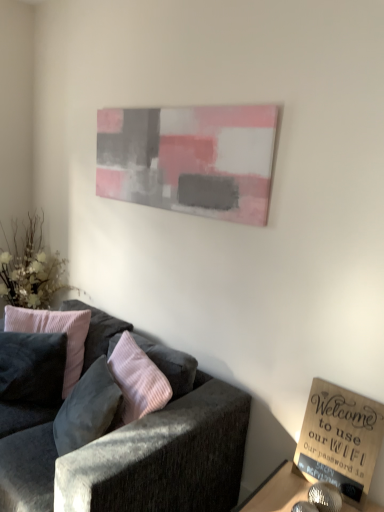
What do you see at coordinates (88, 409) in the screenshot? I see `velvet pink pillow at left, which appears as the 2th pillow when viewed from the left` at bounding box center [88, 409].

The width and height of the screenshot is (384, 512). What do you see at coordinates (340, 440) in the screenshot?
I see `wooden sign at lower right` at bounding box center [340, 440].

Locate an element on the screen. white fabric floral arrangement at left is located at coordinates (31, 269).

At what (x,y) coordinates should I click in order to perform the action: click on painted canvas at upper center. Please return your answer as a coordinate pair (x, y). The height and width of the screenshot is (512, 384). Looking at the image, I should click on (189, 159).

What do you see at coordinates (55, 332) in the screenshot? The height and width of the screenshot is (512, 384). I see `pink velvet pillow at left, acting as the first pillow starting from the left` at bounding box center [55, 332].

Where is `velvet pink pillow at left, placed as the 1th pillow when sorted from right to left`? velvet pink pillow at left, placed as the 1th pillow when sorted from right to left is located at coordinates (88, 409).

From the image's perspective, is velvet pink pillow at left, placed as the 1th pillow when sorted from right to left, positioned above or below wooden sign at lower right?

velvet pink pillow at left, placed as the 1th pillow when sorted from right to left, is situated higher than wooden sign at lower right in the image.

What's the angular difference between velvet pink pillow at left, which appears as the 2th pillow when viewed from the left, and wooden sign at lower right's facing directions?

velvet pink pillow at left, which appears as the 2th pillow when viewed from the left, and wooden sign at lower right are facing 23.6 degrees away from each other.

Is point (99, 404) farther from viewer compared to point (238, 505)?

No.

Looking at their sizes, would you say velvet pink pillow at left, placed as the 1th pillow when sorted from right to left, is wider or thinner than wooden sign at lower right?

In the image, velvet pink pillow at left, placed as the 1th pillow when sorted from right to left, appears to be more narrow than wooden sign at lower right.

The height and width of the screenshot is (512, 384). What are the coordinates of `floral arrangement located on the left of wooden sign at lower right` in the screenshot? It's located at (31, 269).

From a real-world perspective, is white fabric floral arrangement at left positioned over wooden sign at lower right based on gravity?

Yes, from a real-world perspective, white fabric floral arrangement at left is above wooden sign at lower right.

Is wooden sign at lower right at the back of white fabric floral arrangement at left?

No, white fabric floral arrangement at left's orientation is not away from wooden sign at lower right.

Measure the distance between white fabric floral arrangement at left and wooden sign at lower right.

white fabric floral arrangement at left and wooden sign at lower right are 6.81 feet apart.

What's the angular difference between pink velvet pillow at left, placed as the second pillow when sorted from right to left, and velvet dark gray couch at lower left's facing directions?

They differ by 35.2 degrees in their facing directions.

From the image's perspective, relative to velvet dark gray couch at lower left, is pink velvet pillow at left, placed as the second pillow when sorted from right to left, above or below?

Clearly, from the image's perspective, pink velvet pillow at left, placed as the second pillow when sorted from right to left, is above velvet dark gray couch at lower left.

Would you say pink velvet pillow at left, placed as the second pillow when sorted from right to left, is outside velvet dark gray couch at lower left?

No, pink velvet pillow at left, placed as the second pillow when sorted from right to left, is inside or overlapping with velvet dark gray couch at lower left.

From a real-world perspective, is pink velvet pillow at left, acting as the first pillow starting from the left, above or below velvet dark gray couch at lower left?

Clearly, from a real-world perspective, pink velvet pillow at left, acting as the first pillow starting from the left, is above velvet dark gray couch at lower left.

Based on the photo, which point is more forward, (183,154) or (32,222)?

Point (183,154)

Is painted canvas at upper center completely or partially outside of white fabric floral arrangement at left?

Yes, painted canvas at upper center is outside of white fabric floral arrangement at left.

Can you confirm if painted canvas at upper center is bigger than white fabric floral arrangement at left?

No.

Based on the photo, is there a large distance between painted canvas at upper center and white fabric floral arrangement at left?

Yes, painted canvas at upper center and white fabric floral arrangement at left are located far from each other.

From the image's perspective, which is above, velvet dark gray couch at lower left or pink velvet pillow at left, placed as the second pillow when sorted from right to left?

pink velvet pillow at left, placed as the second pillow when sorted from right to left, is shown above in the image.

Looking at this image, is velvet dark gray couch at lower left next to pink velvet pillow at left, placed as the second pillow when sorted from right to left?

No, velvet dark gray couch at lower left is not next to pink velvet pillow at left, placed as the second pillow when sorted from right to left.

Locate an element on the screen. studio couch below the pink velvet pillow at left, placed as the second pillow when sorted from right to left (from the image's perspective) is located at coordinates (136, 452).

Is velvet pink pillow at left, placed as the 1th pillow when sorted from right to left, far away from wooden sign at lower right?

Answer: velvet pink pillow at left, placed as the 1th pillow when sorted from right to left, is near wooden sign at lower right, not far away.

Is velvet pink pillow at left, placed as the 1th pillow when sorted from right to left, looking in the opposite direction of wooden sign at lower right?

That's not correct — velvet pink pillow at left, placed as the 1th pillow when sorted from right to left, is not looking away from wooden sign at lower right.

Considering the relative sizes of velvet pink pillow at left, placed as the 1th pillow when sorted from right to left, and wooden sign at lower right in the image provided, is velvet pink pillow at left, placed as the 1th pillow when sorted from right to left, shorter than wooden sign at lower right?

In fact, velvet pink pillow at left, placed as the 1th pillow when sorted from right to left, may be taller than wooden sign at lower right.

How distant is velvet pink pillow at left, which appears as the 2th pillow when viewed from the left, from wooden sign at lower right?

A distance of 35.00 inches exists between velvet pink pillow at left, which appears as the 2th pillow when viewed from the left, and wooden sign at lower right.

Is velvet dark gray couch at lower left at the back of wooden sign at lower right?

No, wooden sign at lower right's orientation is not away from velvet dark gray couch at lower left.

Is wooden sign at lower right bigger or smaller than velvet dark gray couch at lower left?

Clearly, wooden sign at lower right is smaller in size than velvet dark gray couch at lower left.

Is wooden sign at lower right wider or thinner than velvet dark gray couch at lower left?

wooden sign at lower right is thinner than velvet dark gray couch at lower left.

Which of these two, wooden sign at lower right or velvet dark gray couch at lower left, stands taller?

Standing taller between the two is velvet dark gray couch at lower left.

This screenshot has height=512, width=384. Find the location of `table in front of the velvet pink pillow at left, which appears as the 2th pillow when viewed from the left`. table in front of the velvet pink pillow at left, which appears as the 2th pillow when viewed from the left is located at coordinates (277, 490).

Find the location of `book located on the right of white fabric floral arrangement at left`. book located on the right of white fabric floral arrangement at left is located at coordinates (340, 440).

Estimate the real-world distances between objects in this image. Which object is closer to wooden sign at lower right, velvet pink pillow at left, which appears as the 2th pillow when viewed from the left, or pink velvet pillow at left, placed as the second pillow when sorted from right to left?

velvet pink pillow at left, which appears as the 2th pillow when viewed from the left, is closer to wooden sign at lower right.

Considering their positions, is velvet pink pillow at left, placed as the 1th pillow when sorted from right to left, positioned closer to wooden sign at lower right than wooden sign at lower right?

Based on the image, wooden sign at lower right appears to be nearer to wooden sign at lower right.

Looking at the image, which one is located closer to velvet dark gray couch at lower left, white fabric floral arrangement at left or pink velvet pillow at left, placed as the second pillow when sorted from right to left?

The object closer to velvet dark gray couch at lower left is pink velvet pillow at left, placed as the second pillow when sorted from right to left.

Based on their spatial positions, is wooden sign at lower right or wooden sign at lower right further from velvet pink pillow at left, which appears as the 2th pillow when viewed from the left?

wooden sign at lower right is positioned further to the anchor velvet pink pillow at left, which appears as the 2th pillow when viewed from the left.

Which object lies further to the anchor point velvet pink pillow at left, placed as the 1th pillow when sorted from right to left, wooden sign at lower right or painted canvas at upper center?

painted canvas at upper center.

Considering their positions, is painted canvas at upper center positioned closer to wooden sign at lower right than velvet pink pillow at left, placed as the 1th pillow when sorted from right to left?

velvet pink pillow at left, placed as the 1th pillow when sorted from right to left, is closer to wooden sign at lower right.

Considering their positions, is wooden sign at lower right positioned closer to wooden sign at lower right than painted canvas at upper center?

Among the two, wooden sign at lower right is located nearer to wooden sign at lower right.

When comparing their distances from wooden sign at lower right, does painted canvas at upper center or white fabric floral arrangement at left seem further?

white fabric floral arrangement at left is further to wooden sign at lower right.

Identify the location of pillow between velvet pink pillow at left, placed as the 1th pillow when sorted from right to left, and white fabric floral arrangement at left in the front-back direction. The height and width of the screenshot is (512, 384). (55, 332).

Identify the location of pillow between pink velvet pillow at left, acting as the first pillow starting from the left, and wooden sign at lower right from left to right. (88, 409).

Locate an element on the screen. This screenshot has width=384, height=512. book between painted canvas at upper center and wooden sign at lower right vertically is located at coordinates (340, 440).

Where is `studio couch located between pink velvet pillow at left, acting as the first pillow starting from the left, and wooden sign at lower right in the left-right direction`? This screenshot has height=512, width=384. studio couch located between pink velvet pillow at left, acting as the first pillow starting from the left, and wooden sign at lower right in the left-right direction is located at coordinates (136, 452).